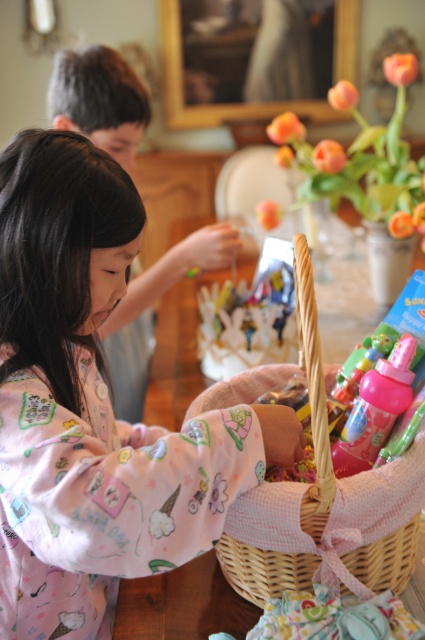
Is pink cotton pajamas at left positioned before woven wicker basket at center?

That is True.

Does point (8, 369) come closer to viewer compared to point (325, 445)?

No, (8, 369) is further to viewer.

Which is in front, point (88, 200) or point (410, 548)?

Positioned in front is point (88, 200).

Identify the location of pink cotton pajamas at left. Image resolution: width=425 pixels, height=640 pixels. (93, 406).

Looking at this image, does woven wicker basket at center have a greater width compared to pink fabric at center?

No.

Can you confirm if woven wicker basket at center is positioned to the right of pink fabric at center?

Yes, woven wicker basket at center is to the right of pink fabric at center.

The image size is (425, 640). Describe the element at coordinates (325, 509) in the screenshot. I see `woven wicker basket at center` at that location.

Identify the location of woven wicker basket at center. Image resolution: width=425 pixels, height=640 pixels. (325, 509).

Who is shorter, pink cotton pajamas at left or pink fabric at center?

With less height is pink fabric at center.

Where is `pink cotton pajamas at left`? The height and width of the screenshot is (640, 425). pink cotton pajamas at left is located at coordinates (93, 406).